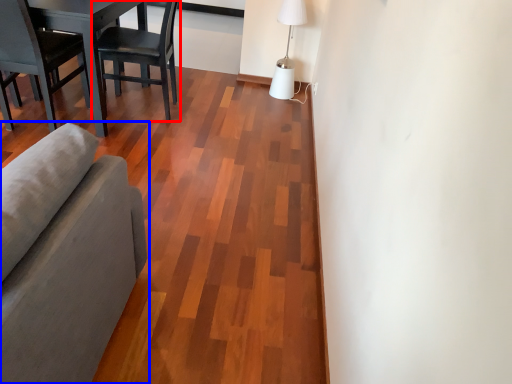
Question: Which object appears farthest to the camera in this image, chair (highlighted by a red box) or studio couch (highlighted by a blue box)?

Choices:
 (A) chair
 (B) studio couch

Answer: (A)